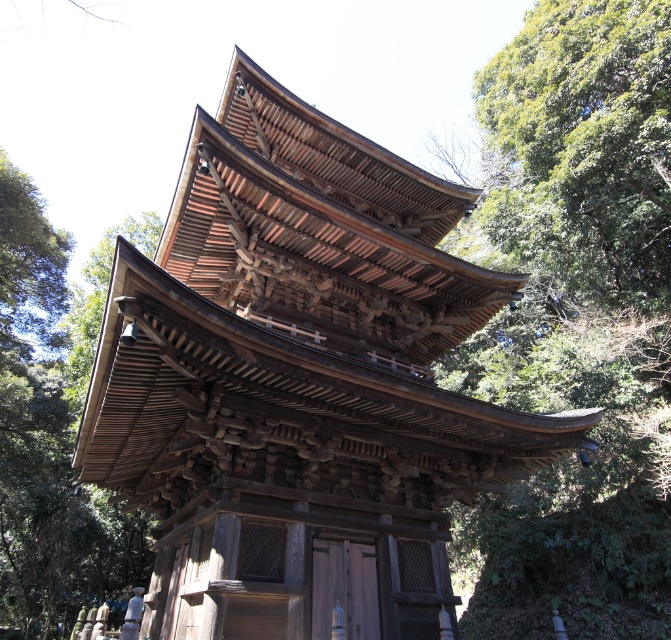
Which is above, wooden temple at center or green leafy tree at upper right?

green leafy tree at upper right

Is wooden temple at center bigger than green leafy tree at upper right?

Actually, wooden temple at center might be smaller than green leafy tree at upper right.

Who is more forward, (289, 316) or (629, 163)?

Point (289, 316) is in front.

Locate an element on the screen. wooden temple at center is located at coordinates (301, 384).